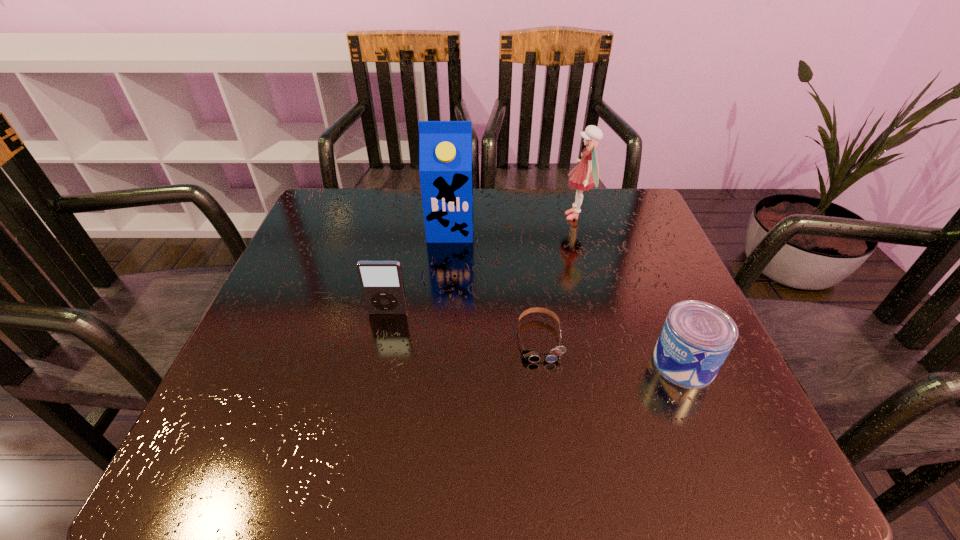
Identify the location of can that is at the right edge. (696, 338).

Identify the location of object positioned at the far right corner. The height and width of the screenshot is (540, 960). (586, 174).

In the image, there is a desktop. At what (x,y) coordinates should I click in order to perform the action: click on free space at the far edge. Please return your answer as a coordinate pair (x, y). This screenshot has width=960, height=540. Looking at the image, I should click on click(378, 240).

Locate an element on the screen. vacant space at the near edge is located at coordinates (380, 433).

In the image, there is a desktop. Where is `vacant space at the left edge`? The image size is (960, 540). vacant space at the left edge is located at coordinates (336, 322).

This screenshot has width=960, height=540. In the image, there is a desktop. Find the location of `blank space at the right edge`. blank space at the right edge is located at coordinates (604, 247).

At what (x,y) coordinates should I click in order to perform the action: click on vacant region at the far left corner of the desktop. Please return your answer as a coordinate pair (x, y). Looking at the image, I should click on (315, 240).

Where is `free space at the far right corner of the desktop`? The image size is (960, 540). free space at the far right corner of the desktop is located at coordinates (646, 227).

Locate an element on the screen. free point between the iPod and the carton is located at coordinates (420, 271).

At what (x,y) coordinates should I click in order to perform the action: click on vacant region between the fourth object from right to left and the third shortest object. Please return your answer as a coordinate pair (x, y). This screenshot has height=540, width=960. Looking at the image, I should click on click(x=420, y=271).